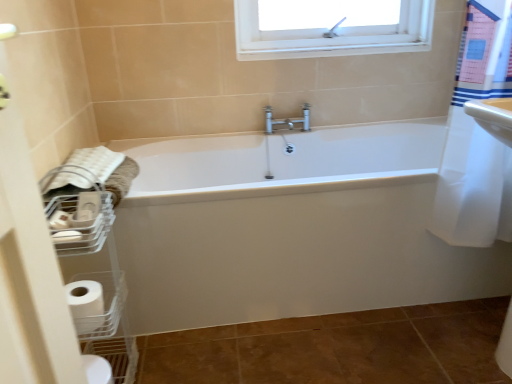
I want to click on vacant point to the right of white plastic basket at lower left, so click(180, 365).